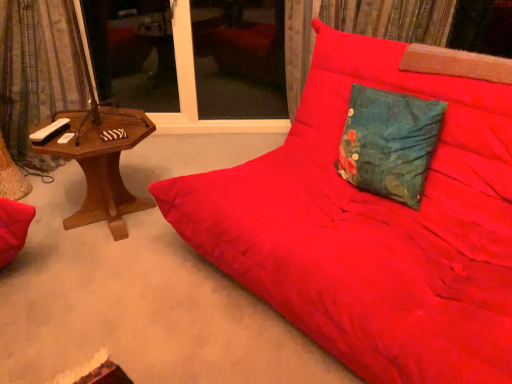
Identify the location of free point behind woodenmaterial/texturetable at left. (156, 162).